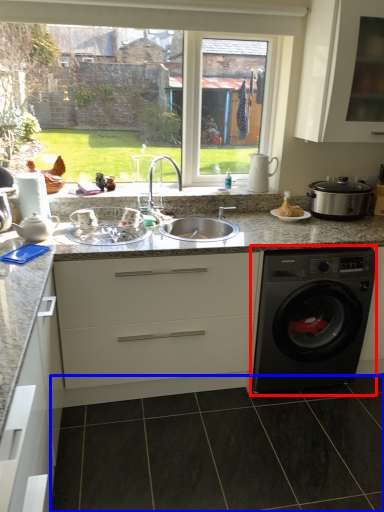
Question: Which of the following is the closest to the observer, washing machine (highlighted by a red box) or tile (highlighted by a blue box)?

Choices:
 (A) washing machine
 (B) tile

Answer: (B)